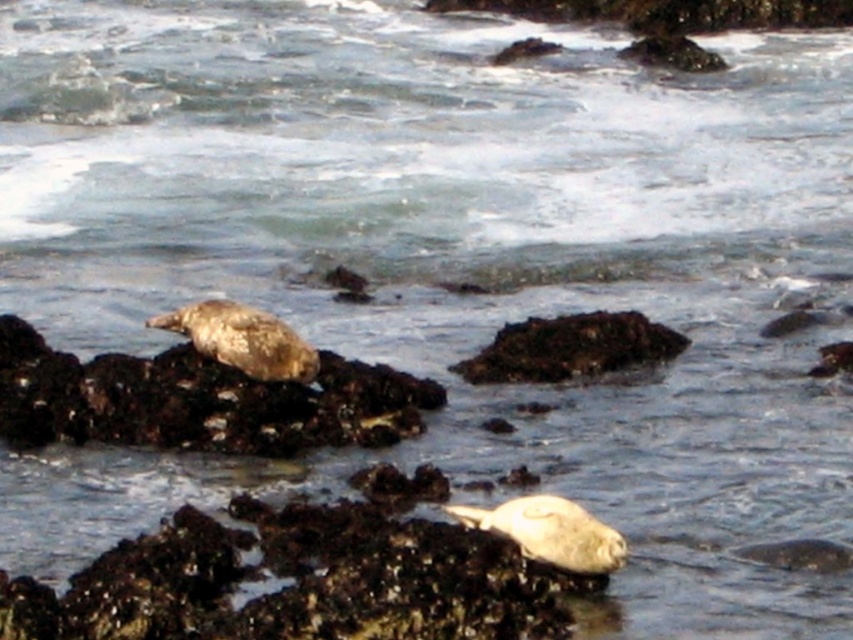
Does grayish-brown fur seal at left have a greater width compared to grayish-brown fur seal at center-left?

Yes, grayish-brown fur seal at left is wider than grayish-brown fur seal at center-left.

Measure the distance between point (187, 364) and camera.

Point (187, 364) is 7.43 meters away from camera.

Image resolution: width=853 pixels, height=640 pixels. What are the coordinates of `grayish-brown fur seal at left` in the screenshot? It's located at (198, 401).

In the scene shown: Does grayish-brown fur seal at left have a lesser width compared to dark brown rock at center?

Incorrect, grayish-brown fur seal at left's width is not less than dark brown rock at center's.

Can you confirm if grayish-brown fur seal at left is positioned below dark brown rock at center?

Correct, grayish-brown fur seal at left is located below dark brown rock at center.

Identify the location of grayish-brown fur seal at left. The width and height of the screenshot is (853, 640). (198, 401).

Can you confirm if dark brown rock at center is smaller than grayish-brown fur seal at center-left?

No.

Between dark brown rock at center and grayish-brown fur seal at center-left, which one has more height?

grayish-brown fur seal at center-left

Does point (628, 330) come in front of point (194, 316)?

No.

Identify the location of dark brown rock at center. (570, 348).